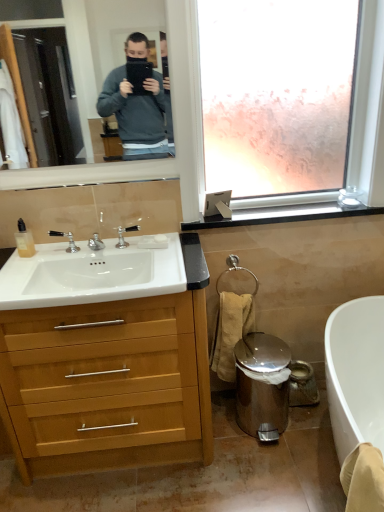
Question: Is matte black tablet at upper center positioned far away from translucent plastic bottle at sink left?

Choices:
 (A) yes
 (B) no

Answer: (A)

Question: Is matte black tablet at upper center positioned with its back to translucent plastic bottle at sink left?

Choices:
 (A) yes
 (B) no

Answer: (B)

Question: From a real-world perspective, is matte black tablet at upper center below translucent plastic bottle at sink left?

Choices:
 (A) no
 (B) yes

Answer: (A)

Question: Considering the relative sizes of matte black tablet at upper center and translucent plastic bottle at sink left in the image provided, is matte black tablet at upper center taller than translucent plastic bottle at sink left?

Choices:
 (A) no
 (B) yes

Answer: (B)

Question: Is matte black tablet at upper center placed right next to translucent plastic bottle at sink left?

Choices:
 (A) no
 (B) yes

Answer: (A)

Question: Is matte black tablet at upper center facing towards translucent plastic bottle at sink left?

Choices:
 (A) no
 (B) yes

Answer: (A)

Question: Considering the relative positions of translucent plastic bottle at sink left and white glossy sink at left in the image provided, is translucent plastic bottle at sink left in front of white glossy sink at left?

Choices:
 (A) no
 (B) yes

Answer: (A)

Question: From a real-world perspective, is translucent plastic bottle at sink left beneath white glossy sink at left?

Choices:
 (A) no
 (B) yes

Answer: (A)

Question: Does translucent plastic bottle at sink left come behind white glossy sink at left?

Choices:
 (A) yes
 (B) no

Answer: (A)

Question: Can you confirm if translucent plastic bottle at sink left is positioned to the right of white glossy sink at left?

Choices:
 (A) yes
 (B) no

Answer: (B)

Question: Is translucent plastic bottle at sink left taller than white glossy sink at left?

Choices:
 (A) no
 (B) yes

Answer: (A)

Question: From the image's perspective, is translucent plastic bottle at sink left located beneath white glossy sink at left?

Choices:
 (A) no
 (B) yes

Answer: (A)

Question: Is black plastic window sill at upper right positioned behind white matte soap at sink?

Choices:
 (A) no
 (B) yes

Answer: (B)